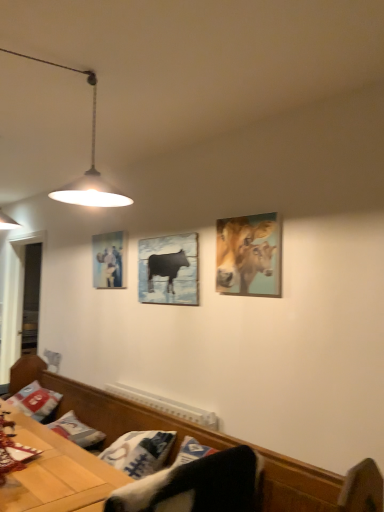
In order to face golden textured cows at upper right, should I rotate leftwards or rightwards?

You should look right and rotate roughly 7.324 degrees.

Describe the element at coordinates (168, 269) in the screenshot. I see `matte black cow at center, which is the second picture frame from left to right` at that location.

What do you see at coordinates (36, 401) in the screenshot? I see `white cotton pillow at lower left` at bounding box center [36, 401].

You are a GUI agent. You are given a task and a screenshot of the screen. Output one action in this format:
    pyautogui.click(x=<x>, y=<y>)
    Task: Click on the black fabric swivel chair at lower center
    
    Given the screenshot: What is the action you would take?
    pyautogui.click(x=196, y=485)

From the image's perspective, which one is positioned higher, white cotton pillow at lower left or matte black cow at center, which is the second picture frame from left to right?

matte black cow at center, which is the second picture frame from left to right, appears higher in the image.

How many degrees apart are the facing directions of white cotton pillow at lower left and matte black cow at center, which is the second picture frame from left to right?

0.935 degrees separate the facing orientations of white cotton pillow at lower left and matte black cow at center, which is the second picture frame from left to right.

From a real-world perspective, which is physically above, white cotton pillow at lower left or matte black cow at center, which is the second picture frame from left to right?

From a 3D spatial view, matte black cow at center, which is the second picture frame from left to right, is above.

The image size is (384, 512). I want to click on picture frame that is the 2nd one when counting rightward from the white cotton pillow at lower left, so click(168, 269).

Is wooden bench at lower center bigger or smaller than white cotton pillow at lower left?

Clearly, wooden bench at lower center is larger in size than white cotton pillow at lower left.

Is wooden bench at lower center far away from white cotton pillow at lower left?

No.

Does point (104, 430) come closer to viewer compared to point (35, 403)?

Yes, point (104, 430) is in front of point (35, 403).

Does wooden bench at lower center turn towards white cotton pillow at lower left?

Yes, wooden bench at lower center is aimed at white cotton pillow at lower left.

From the image's perspective, which is above, black fabric swivel chair at lower center or matte glass picture frame at upper left, placed as the second picture frame when sorted from front to back?

From the image's view, matte glass picture frame at upper left, placed as the second picture frame when sorted from front to back, is above.

Considering the sizes of objects black fabric swivel chair at lower center and matte glass picture frame at upper left, marked as the first picture frame in a left-to-right arrangement, in the image provided, who is taller, black fabric swivel chair at lower center or matte glass picture frame at upper left, marked as the first picture frame in a left-to-right arrangement,?

With more height is matte glass picture frame at upper left, marked as the first picture frame in a left-to-right arrangement.

Is black fabric swivel chair at lower center oriented away from matte glass picture frame at upper left, the 2th picture frame in the right-to-left sequence?

No, black fabric swivel chair at lower center's orientation is not away from matte glass picture frame at upper left, the 2th picture frame in the right-to-left sequence.

From a real-world perspective, relative to matte glass picture frame at upper left, marked as the first picture frame in a left-to-right arrangement, is black fabric swivel chair at lower center vertically above or below?

From a real-world perspective, black fabric swivel chair at lower center is physically below matte glass picture frame at upper left, marked as the first picture frame in a left-to-right arrangement.

Considering the relative positions of matte glass picture frame at upper left, marked as the first picture frame in a left-to-right arrangement, and wooden bench at lower center in the image provided, is matte glass picture frame at upper left, marked as the first picture frame in a left-to-right arrangement, to the right of wooden bench at lower center from the viewer's perspective?

In fact, matte glass picture frame at upper left, marked as the first picture frame in a left-to-right arrangement, is to the left of wooden bench at lower center.

From the image's perspective, is matte glass picture frame at upper left, the 2th picture frame in the right-to-left sequence, beneath wooden bench at lower center?

Actually, matte glass picture frame at upper left, the 2th picture frame in the right-to-left sequence, appears above wooden bench at lower center in the image.

Image resolution: width=384 pixels, height=512 pixels. Find the location of `picture frame that is the 2nd one when counting backward from the wooden bench at lower center`. picture frame that is the 2nd one when counting backward from the wooden bench at lower center is located at coordinates (109, 260).

Does point (135, 511) come in front of point (92, 187)?

That is True.

From the image's perspective, relative to metallic pendant light at upper left, is black fabric swivel chair at lower center above or below?

Based on their image positions, black fabric swivel chair at lower center is located beneath metallic pendant light at upper left.

Looking at this image, is black fabric swivel chair at lower center located outside metallic pendant light at upper left?

Absolutely, black fabric swivel chair at lower center is external to metallic pendant light at upper left.

Does black fabric swivel chair at lower center come behind metallic pendant light at upper left?

Yes.

From the image's perspective, is golden textured cows at upper right positioned above or below metallic pendant light at upper left?

golden textured cows at upper right is below metallic pendant light at upper left.

Who is more distant, golden textured cows at upper right or metallic pendant light at upper left?

Positioned behind is golden textured cows at upper right.

Is golden textured cows at upper right bigger or smaller than metallic pendant light at upper left?

In the image, golden textured cows at upper right appears to be smaller than metallic pendant light at upper left.

Identify the location of cattle on the right of metallic pendant light at upper left. (242, 252).

From a real-world perspective, does white cotton pillow at lower left sit lower than wooden bench at lower center?

Incorrect, from a real-world perspective, white cotton pillow at lower left is higher than wooden bench at lower center.

Is white cotton pillow at lower left not within wooden bench at lower center?

No.

Find the location of a particular element. The height and width of the screenshot is (512, 384). pillow behind the wooden bench at lower center is located at coordinates coord(36,401).

Locate an element on the screen. pillow behind the matte black cow at center, which ranks as the 2th picture frame in back-to-front order is located at coordinates (36, 401).

Find the location of a particular element. The image size is (384, 512). furniture below the white cotton pillow at lower left (from a real-world perspective) is located at coordinates [317, 487].

Based on their spatial positions, is matte glass picture frame at upper left, marked as the first picture frame in a left-to-right arrangement, or metallic pendant light at upper left further from black fabric swivel chair at lower center?

Among the two, matte glass picture frame at upper left, marked as the first picture frame in a left-to-right arrangement, is located further to black fabric swivel chair at lower center.

From the image, which object appears to be farther from matte glass picture frame at upper left, placed as the first picture frame when sorted from back to front, metallic pendant light at upper left or matte black cow at center, which ranks as the 2th picture frame in back-to-front order?

metallic pendant light at upper left lies further to matte glass picture frame at upper left, placed as the first picture frame when sorted from back to front, than the other object.

Estimate the real-world distances between objects in this image. Which object is further from black fabric swivel chair at lower center, golden textured cows at upper right or matte black cow at center, which ranks as the 1th picture frame in right-to-left order?

Based on the image, matte black cow at center, which ranks as the 1th picture frame in right-to-left order, appears to be further to black fabric swivel chair at lower center.

From the image, which object appears to be nearer to wooden table at lower left, black fabric swivel chair at lower center or matte glass picture frame at upper left, placed as the first picture frame when sorted from back to front?

black fabric swivel chair at lower center lies closer to wooden table at lower left than the other object.

Considering their positions, is metallic pendant light at upper left positioned further to wooden bench at lower center than golden textured cows at upper right?

Among the two, metallic pendant light at upper left is located further to wooden bench at lower center.

Which object lies nearer to the anchor point white cotton pillow at lower left, matte glass picture frame at upper left, the 2th picture frame in the right-to-left sequence, or golden textured cows at upper right?

Based on the image, matte glass picture frame at upper left, the 2th picture frame in the right-to-left sequence, appears to be nearer to white cotton pillow at lower left.

When comparing their distances from black fabric swivel chair at lower center, does wooden bench at lower center or white cotton pillow at lower left seem further?

white cotton pillow at lower left lies further to black fabric swivel chair at lower center than the other object.

Estimate the real-world distances between objects in this image. Which object is closer to golden textured cows at upper right, white cotton pillow at lower left or wooden table at lower left?

Among the two, wooden table at lower left is located nearer to golden textured cows at upper right.

The width and height of the screenshot is (384, 512). Identify the location of cattle between metallic pendant light at upper left and wooden table at lower left from top to bottom. (242, 252).

You are a GUI agent. You are given a task and a screenshot of the screen. Output one action in this format:
    pyautogui.click(x=<x>, y=<y>)
    Task: Click on the cattle positioned between wooden bench at lower center and matte glass picture frame at upper left, placed as the first picture frame when sorted from back to front, from near to far
    Image resolution: width=384 pixels, height=512 pixels.
    Given the screenshot: What is the action you would take?
    pyautogui.click(x=242, y=252)

At what (x,y) coordinates should I click in order to perform the action: click on cattle between metallic pendant light at upper left and wooden bench at lower center in the vertical direction. Please return your answer as a coordinate pair (x, y). The width and height of the screenshot is (384, 512). Looking at the image, I should click on [x=242, y=252].

You are a GUI agent. You are given a task and a screenshot of the screen. Output one action in this format:
    pyautogui.click(x=<x>, y=<y>)
    Task: Click on the swivel chair between metallic pendant light at upper left and white cotton pillow at lower left in the up-down direction
    This screenshot has height=512, width=384.
    Given the screenshot: What is the action you would take?
    pyautogui.click(x=196, y=485)